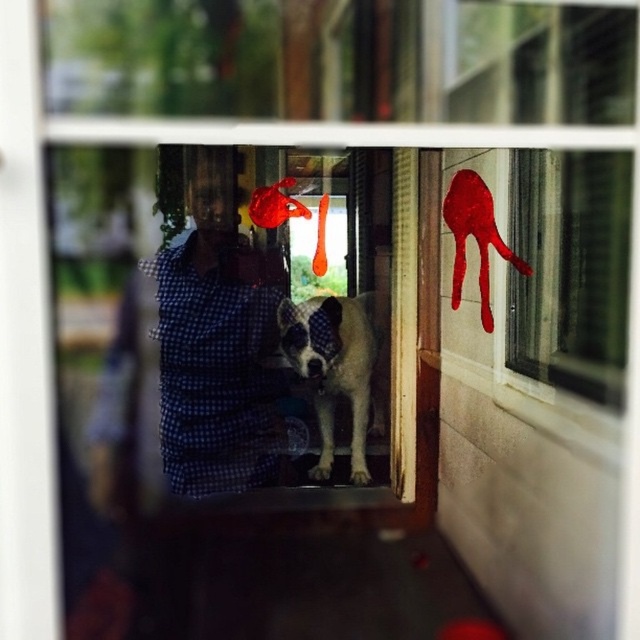
You are standing outside the window and want to touch the blue checkered shirt at center. Which direction should you move your hand to reach the point on the blue checkered shirt at center indicated by the coordinates point (x=218, y=342)?

The point (x=218, y=342) is on the blue checkered shirt at center, so you should move your hand directly towards the center of the shirt to reach that point.

You are standing outside the house looking through the window. There is a point at coordinate (570, 269). What object is located at that point?

The transparent glass window at upper right is located at point (570, 269).

Based on the photo, you are an interior designer assessing the layout of a room. You notice the white fur dog at center and the smooth glossy paw print at upper right. Which object occupies more vertical space in the scene?

The white fur dog at center has a greater height compared to the smooth glossy paw print at upper right, so it occupies more vertical space in the scene.